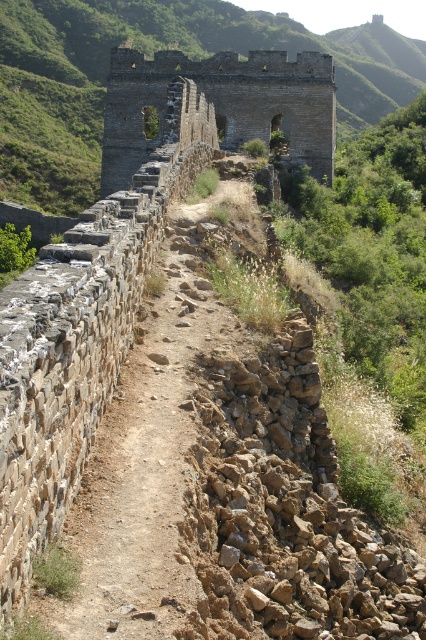
Question: Which object is closer to the camera taking this photo?

Choices:
 (A) stone wall at center
 (B) brown stone path at center

Answer: (B)

Question: In this image, where is brown stone path at center located relative to stone wall at center?

Choices:
 (A) left
 (B) right

Answer: (B)

Question: Which of the following is the closest to the observer?

Choices:
 (A) brown stone path at center
 (B) stone wall at center

Answer: (A)

Question: Can you confirm if brown stone path at center is wider than stone wall at center?

Choices:
 (A) yes
 (B) no

Answer: (B)

Question: Is brown stone path at center thinner than stone wall at center?

Choices:
 (A) yes
 (B) no

Answer: (A)

Question: Which object appears closest to the camera in this image?

Choices:
 (A) stone wall at center
 (B) brown stone path at center

Answer: (B)